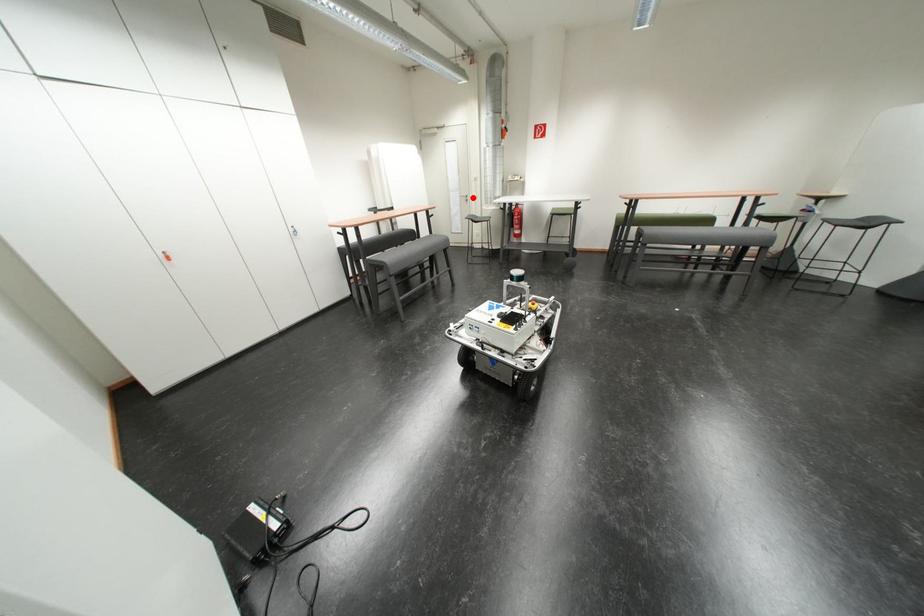
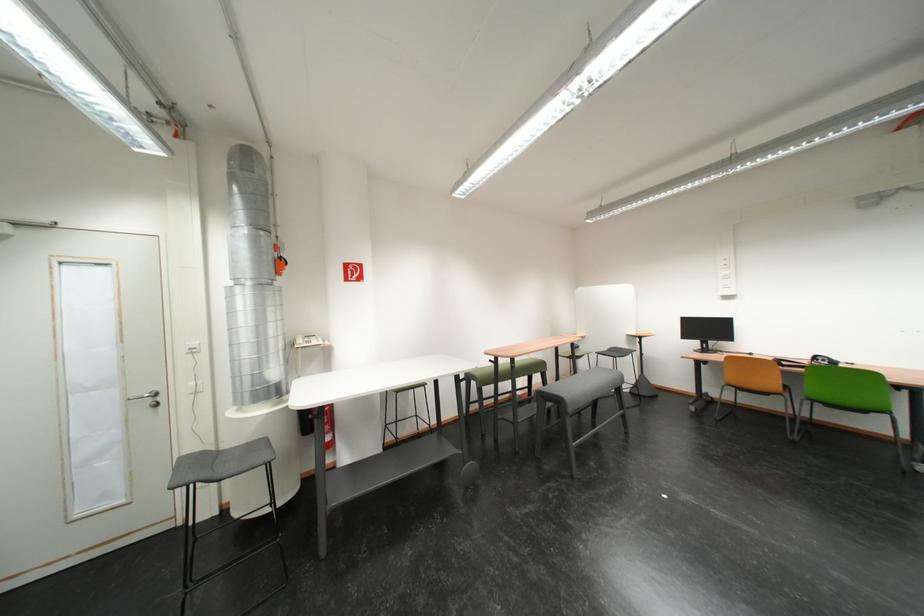
Question: I am providing you with two images of the same scene from different viewpoints. A red point is marked on the first image. Can you still see the location of the red point in image 2?

Choices:
 (A) Yes
 (B) No

Answer: (A)